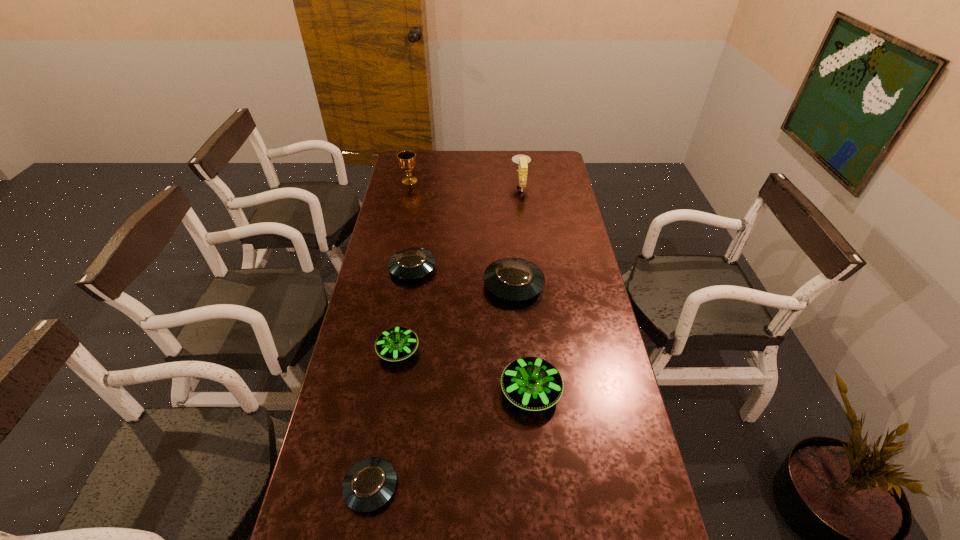
At what (x,y) coordinates should I click in order to perform the action: click on vacant region between the nearest object and the biggest gray saucer. Please return your answer as a coordinate pair (x, y). Looking at the image, I should click on (442, 386).

Where is `unoccupied area between the second smallest gray saucer and the right green saucer`? The width and height of the screenshot is (960, 540). unoccupied area between the second smallest gray saucer and the right green saucer is located at coordinates (471, 329).

Where is `unoccupied area between the second biggest gray saucer and the nearest saucer`? This screenshot has height=540, width=960. unoccupied area between the second biggest gray saucer and the nearest saucer is located at coordinates (392, 377).

Identify which object is the fifth nearest to the right green saucer. Please provide its 2D coordinates. Your answer should be formatted as a tuple, i.e. [(x, y)], where the tuple contains the x and y coordinates of a point satisfying the conditions above.

[(522, 160)]

Point out which object is positioned as the nearest to the chalice. Please provide its 2D coordinates. Your answer should be formatted as a tuple, i.e. [(x, y)], where the tuple contains the x and y coordinates of a point satisfying the conditions above.

[(522, 160)]

Locate which saucer is the fifth closest to the sponge. Please provide its 2D coordinates. Your answer should be formatted as a tuple, i.e. [(x, y)], where the tuple contains the x and y coordinates of a point satisfying the conditions above.

[(369, 484)]

Point out which saucer is positioned as the fourth nearest to the nearest object. Please provide its 2D coordinates. Your answer should be formatted as a tuple, i.e. [(x, y)], where the tuple contains the x and y coordinates of a point satisfying the conditions above.

[(411, 263)]

The height and width of the screenshot is (540, 960). What are the coordinates of `gray saucer that stands as the closest to the shortest saucer` in the screenshot? It's located at (514, 279).

At what (x,y) coordinates should I click in order to perform the action: click on gray saucer that is the third closest one to the gold chalice. Please return your answer as a coordinate pair (x, y). The image size is (960, 540). Looking at the image, I should click on (369, 484).

Image resolution: width=960 pixels, height=540 pixels. What are the coordinates of `free space that satisfies the following two spatial constraints: 1. on the front-facing side of the yellow sponge; 2. on the front side of the biggest gray saucer` in the screenshot? It's located at (533, 285).